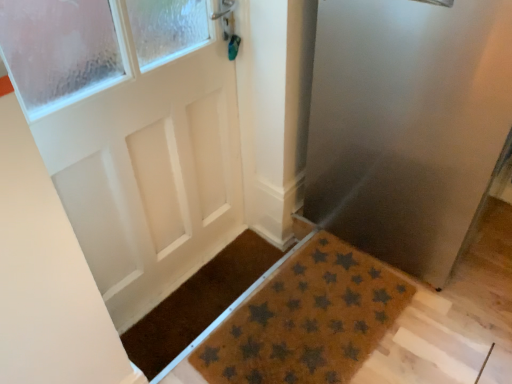
Question: Does brown textured mat at lower right have a greater height compared to brown coir mat at center, which is the 1th doormat in left-to-right order?

Choices:
 (A) no
 (B) yes

Answer: (B)

Question: Does brown textured mat at lower right have a lesser height compared to brown coir mat at center, acting as the second doormat starting from the right?

Choices:
 (A) yes
 (B) no

Answer: (B)

Question: Does brown textured mat at lower right appear on the right side of brown coir mat at center, which is the 1th doormat in left-to-right order?

Choices:
 (A) yes
 (B) no

Answer: (A)

Question: Is the position of brown textured mat at lower right less distant than that of brown coir mat at center, which is the 1th doormat in left-to-right order?

Choices:
 (A) no
 (B) yes

Answer: (B)

Question: Is brown textured mat at lower right completely or partially outside of brown coir mat at center, acting as the second doormat starting from the right?

Choices:
 (A) no
 (B) yes

Answer: (B)

Question: Looking at their shapes, would you say brown coir mat at center, which is the 1th doormat in left-to-right order, is wider or thinner than brown textured mat at lower right?

Choices:
 (A) wide
 (B) thin

Answer: (B)

Question: From their relative heights in the image, would you say brown coir mat at center, acting as the second doormat starting from the right, is taller or shorter than brown textured mat at lower right?

Choices:
 (A) short
 (B) tall

Answer: (A)

Question: Based on their positions, is brown coir mat at center, acting as the second doormat starting from the right, located to the left or right of brown textured mat at lower right?

Choices:
 (A) left
 (B) right

Answer: (A)

Question: Based on their sizes in the image, would you say brown coir mat at center, acting as the second doormat starting from the right, is bigger or smaller than brown textured mat at lower right?

Choices:
 (A) big
 (B) small

Answer: (B)

Question: From a real-world perspective, is brown coir mat with star pattern at lower center, the first doormat from the right, positioned above or below brown textured mat at lower right?

Choices:
 (A) above
 (B) below

Answer: (B)

Question: In terms of height, does brown coir mat with star pattern at lower center, the second doormat viewed from the left, look taller or shorter compared to brown textured mat at lower right?

Choices:
 (A) tall
 (B) short

Answer: (B)

Question: Looking at the image, does brown coir mat with star pattern at lower center, the first doormat from the right, seem bigger or smaller compared to brown textured mat at lower right?

Choices:
 (A) small
 (B) big

Answer: (A)

Question: From the image's perspective, is brown coir mat with star pattern at lower center, the second doormat viewed from the left, positioned above or below brown textured mat at lower right?

Choices:
 (A) below
 (B) above

Answer: (A)

Question: Considering their positions, is brown textured mat at lower right located in front of or behind brown coir mat with star pattern at lower center, the first doormat from the right?

Choices:
 (A) front
 (B) behind

Answer: (A)

Question: In terms of width, does brown textured mat at lower right look wider or thinner when compared to brown coir mat with star pattern at lower center, the second doormat viewed from the left?

Choices:
 (A) thin
 (B) wide

Answer: (B)